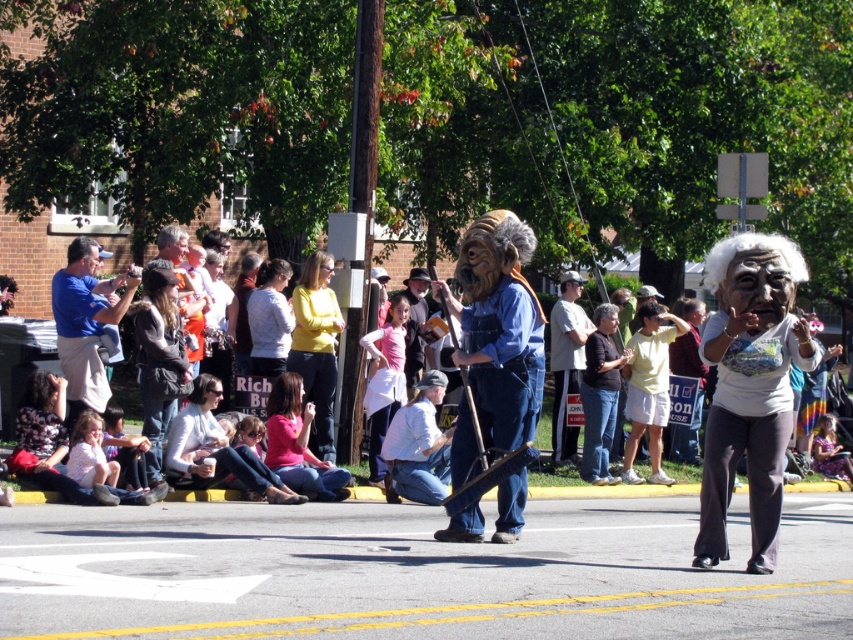
You are a photographer standing at the back of the crowd trying to capture a photo of the pink fabric dress at center and the brown fuzzy wig at upper center in the same frame. Can you fit both objects into your camera viewfinder if your camera has a minimum required distance of 1.5 meters between objects to capture them both clearly?

The pink fabric dress at center and brown fuzzy wig at upper center are 1.37 meters apart from each other. Since the required distance is 1.5 meters, the photographer cannot fit both objects into the camera viewfinder clearly.

In the scene shown: You are a photographer at the event and want to capture both the yellow matte shirt at center and the pink fabric shirt at center in a single photo. Based on their positions, which shirt will appear in front of the other in the photo?

The yellow matte shirt at center is positioned over pink fabric shirt at center, so the yellow matte shirt at center will appear in front of the pink fabric shirt at center in the photo.